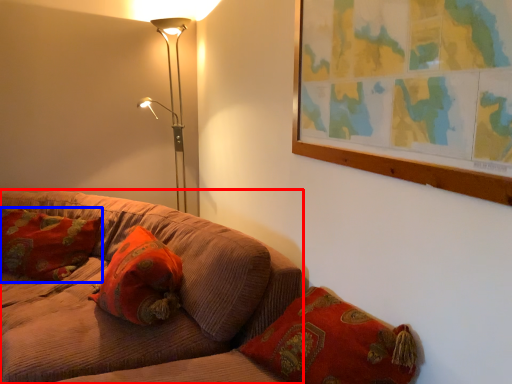
Question: Which point is further to the camera, studio couch (highlighted by a red box) or pillow (highlighted by a blue box)?

Choices:
 (A) studio couch
 (B) pillow

Answer: (B)